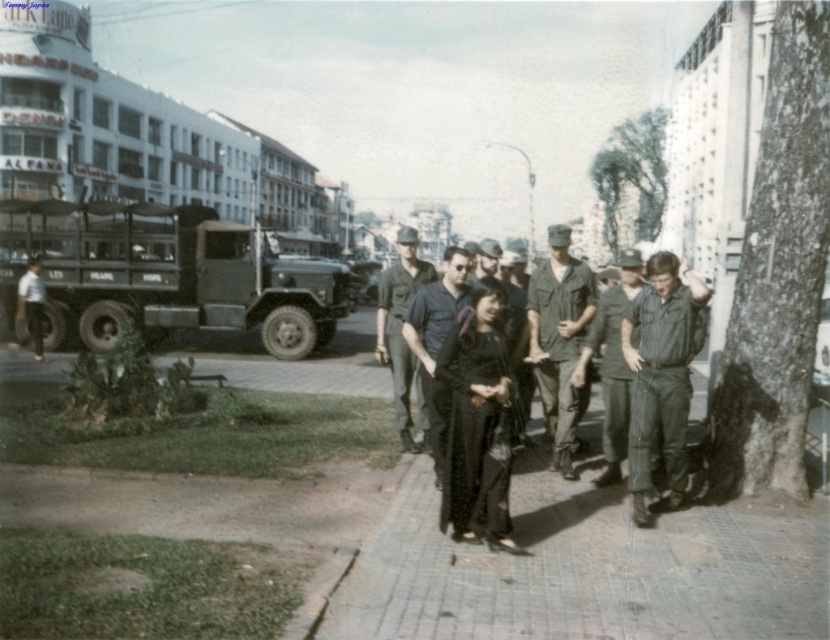
Based on the photo, is black matte dress at center below camouflage fabric uniform at center?

Correct, black matte dress at center is located below camouflage fabric uniform at center.

What do you see at coordinates (475, 433) in the screenshot?
I see `black matte dress at center` at bounding box center [475, 433].

The height and width of the screenshot is (640, 830). In order to click on black matte dress at center in this screenshot , I will do [475, 433].

Can you confirm if green fabric uniform at right is shorter than dark green uniform at center?

Correct, green fabric uniform at right is not as tall as dark green uniform at center.

Can you confirm if green fabric uniform at right is bigger than dark green uniform at center?

No, green fabric uniform at right is not bigger than dark green uniform at center.

Is point (679, 358) positioned after point (421, 420)?

No, (679, 358) is closer to viewer.

Where is `green fabric uniform at right`? The width and height of the screenshot is (830, 640). green fabric uniform at right is located at coordinates (662, 381).

Is green fabric uniform at right to the left of camouflage fabric uniform at center from the viewer's perspective?

No, green fabric uniform at right is not to the left of camouflage fabric uniform at center.

Is point (645, 458) closer to viewer compared to point (536, 310)?

Yes, point (645, 458) is closer to viewer.

The image size is (830, 640). In order to click on green fabric uniform at right in this screenshot , I will do `click(662, 381)`.